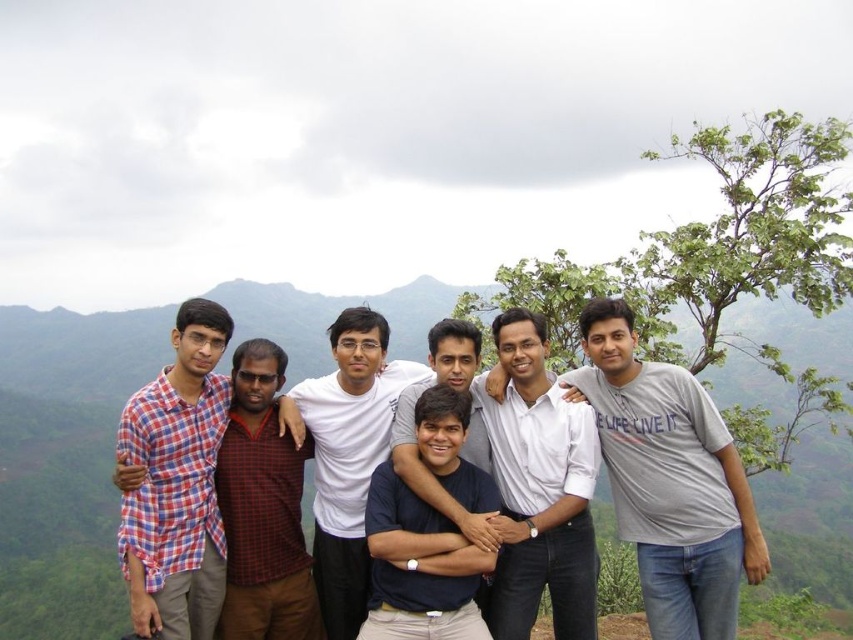
Question: Is white shirt at center wider than checkered fabric shirt at left?

Choices:
 (A) yes
 (B) no

Answer: (B)

Question: Estimate the real-world distances between objects in this image. Which object is closer to the gray cotton t-shirt at center?

Choices:
 (A) dark blue shirt at center
 (B) white cotton shirt at center

Answer: (A)

Question: Does white shirt at center appear on the right side of white cotton shirt at center?

Choices:
 (A) no
 (B) yes

Answer: (B)

Question: Is gray cotton t-shirt at center smaller than white shirt at center?

Choices:
 (A) no
 (B) yes

Answer: (A)

Question: Among these points, which one is nearest to the camera?

Choices:
 (A) (404, 593)
 (B) (331, 611)
 (C) (672, 442)
 (D) (496, 580)

Answer: (A)

Question: Which is nearer to the white cotton shirt at center?

Choices:
 (A) gray cotton t-shirt at center
 (B) dark blue shirt at center
 (C) white shirt at center

Answer: (C)